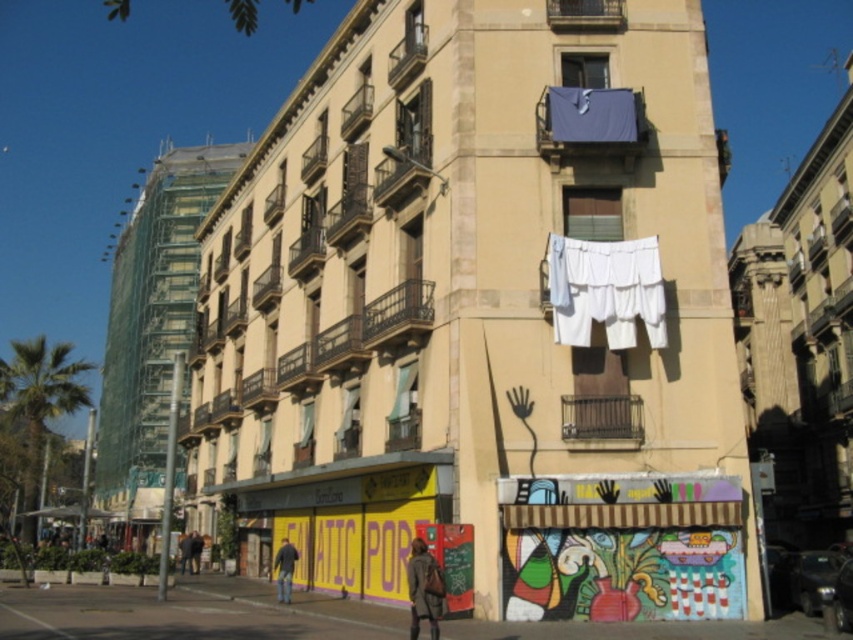
You are standing at the entrance of the beige building in the street scene. Looking towards the upper center, you notice a point marked at coordinates [605,291]. What object is located at that specific point?

The white fabric at upper center is located at point [605,291].

From the picture: You are standing on the sidewalk looking at the building. You see a white fabric at upper center and a dark gray fabric jacket at lower center. Which one is more to the right?

The white fabric at upper center is more to the right than the dark gray fabric jacket at lower center.

Consider the image. You are a delivery person who needs to place a package on the ground floor of the beige building. You see the white fabric at upper center and the denim jeans at lower center. Which object is closer to the delivery area on the ground floor?

The denim jeans at lower center are closer to the delivery area on the ground floor because they are located at lower center, which is closer to the ground floor than the white fabric at upper center.